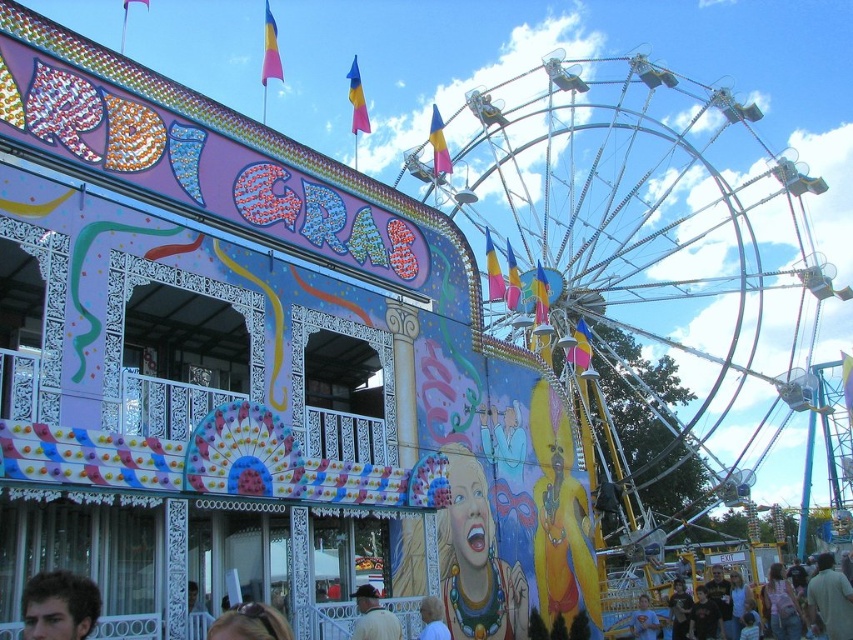
You are standing at the center of the fairground and want to locate the metallic silver ferris wheel at upper right. According to the coordinates provided, where exactly is it positioned?

The metallic silver ferris wheel at upper right is positioned at coordinates point [650,275].

You are standing at the entrance of the Mardi Gras building and want to take a photo of the metallic silver ferris wheel at upper right. Which direction should you face to capture it in your shot?

You should face towards the upper right direction to capture the metallic silver ferris wheel at upper right in your photo.